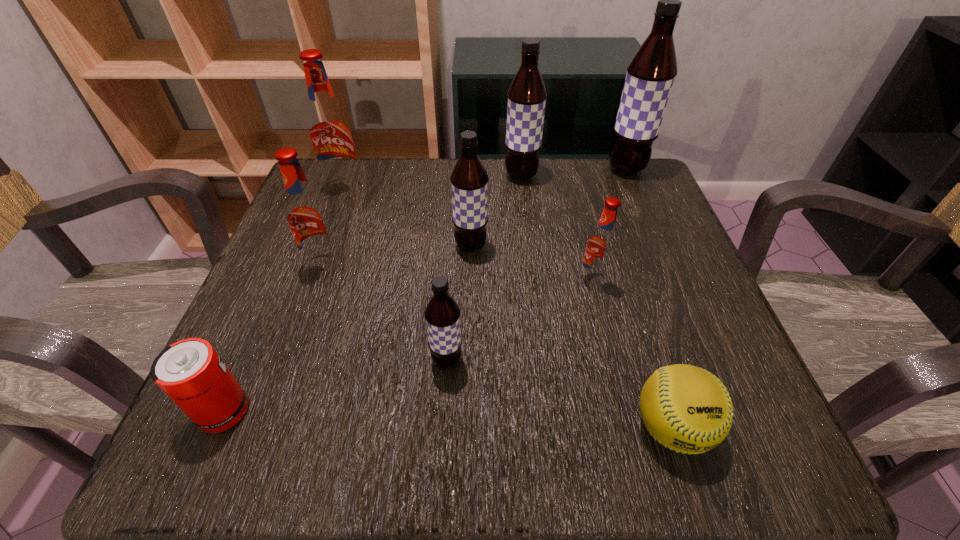
Locate an element on the screen. free region located on the back of the smallest brown root beer is located at coordinates (452, 276).

The width and height of the screenshot is (960, 540). What are the coordinates of `free space located on the right of the second shortest object` in the screenshot? It's located at (283, 411).

The image size is (960, 540). I want to click on can located in the near edge section of the desktop, so click(190, 372).

You are a GUI agent. You are given a task and a screenshot of the screen. Output one action in this format:
    pyautogui.click(x=<x>, y=<y>)
    Task: Click on the softball present at the near edge
    
    Given the screenshot: What is the action you would take?
    pyautogui.click(x=687, y=409)

You are a GUI agent. You are given a task and a screenshot of the screen. Output one action in this format:
    pyautogui.click(x=<x>, y=<y>)
    Task: Click on the can present at the left edge
    This screenshot has height=540, width=960.
    Given the screenshot: What is the action you would take?
    pyautogui.click(x=190, y=372)

The image size is (960, 540). In order to click on root beer at the right edge in this screenshot , I will do `click(650, 75)`.

The image size is (960, 540). I want to click on softball present at the right edge, so click(x=687, y=409).

Find the location of a particular element. Image resolution: width=960 pixels, height=540 pixels. object that is at the far left corner is located at coordinates (329, 129).

Find the location of `object located in the near left corner section of the desktop`. object located in the near left corner section of the desktop is located at coordinates (190, 372).

The width and height of the screenshot is (960, 540). What are the coordinates of `object positioned at the far right corner` in the screenshot? It's located at (650, 75).